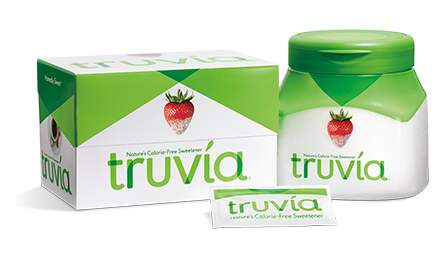
Find the location of `box`. box is located at coordinates (252, 124).